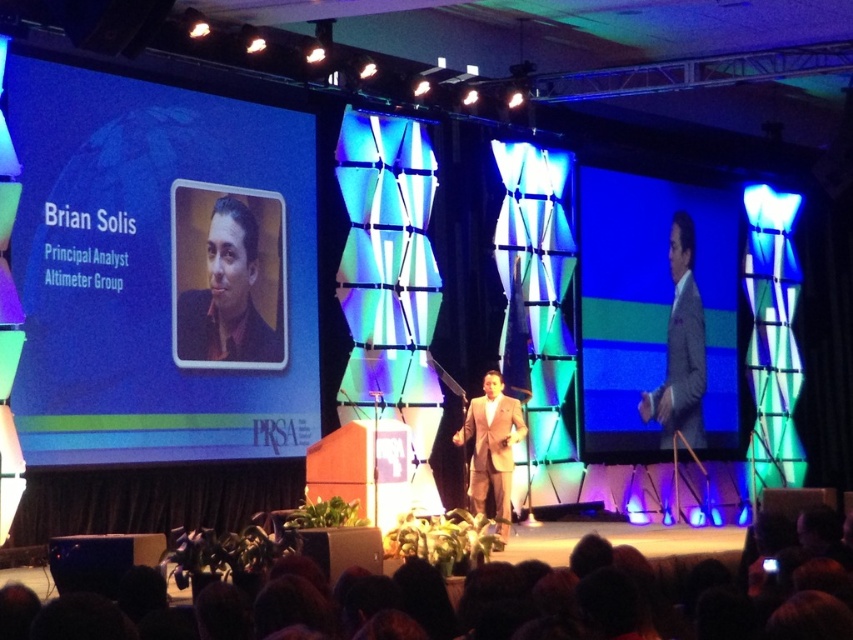
Question: Which of the following is the closest to the observer?

Choices:
 (A) blue glossy projection screen at left
 (B) matte gray suit at center

Answer: (A)

Question: Does blue glossy projection screen at left come in front of matte gray suit at right?

Choices:
 (A) no
 (B) yes

Answer: (B)

Question: Which object appears closest to the camera in this image?

Choices:
 (A) tan fabric suit at center
 (B) matte gray suit at center

Answer: (A)

Question: Does matte gray suit at right have a smaller size compared to matte gray suit at center?

Choices:
 (A) yes
 (B) no

Answer: (B)

Question: Among these objects, which one is nearest to the camera?

Choices:
 (A) matte black suit at center
 (B) tan fabric suit at center
 (C) matte gray suit at right
 (D) matte gray suit at center

Answer: (B)

Question: Does blue glossy projection screen at left come behind matte black suit at center?

Choices:
 (A) yes
 (B) no

Answer: (B)